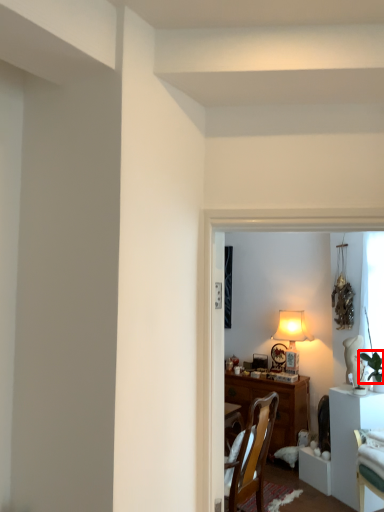
Question: From the image's perspective, what is the correct spatial positioning of plant (annotated by the red box) in reference to table?

Choices:
 (A) above
 (B) below

Answer: (A)